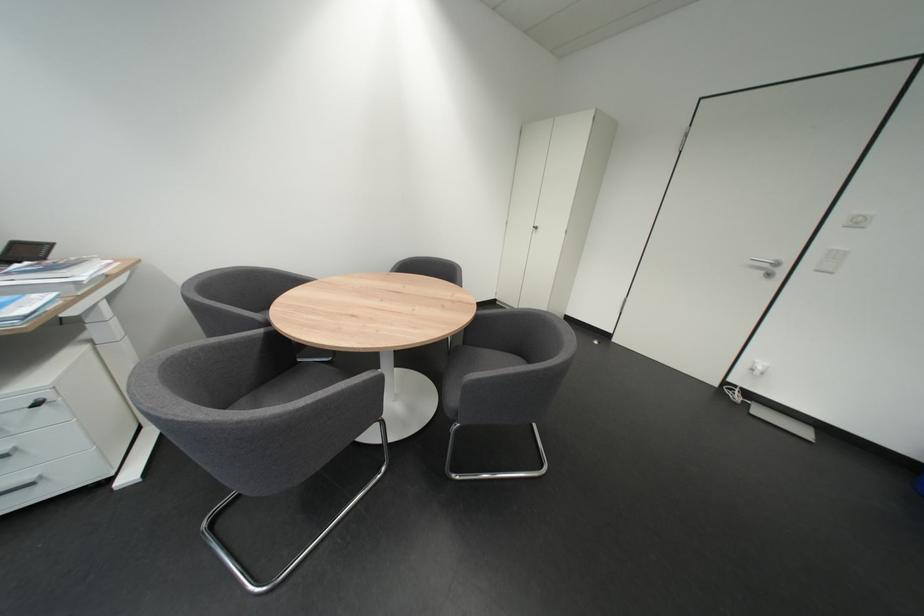
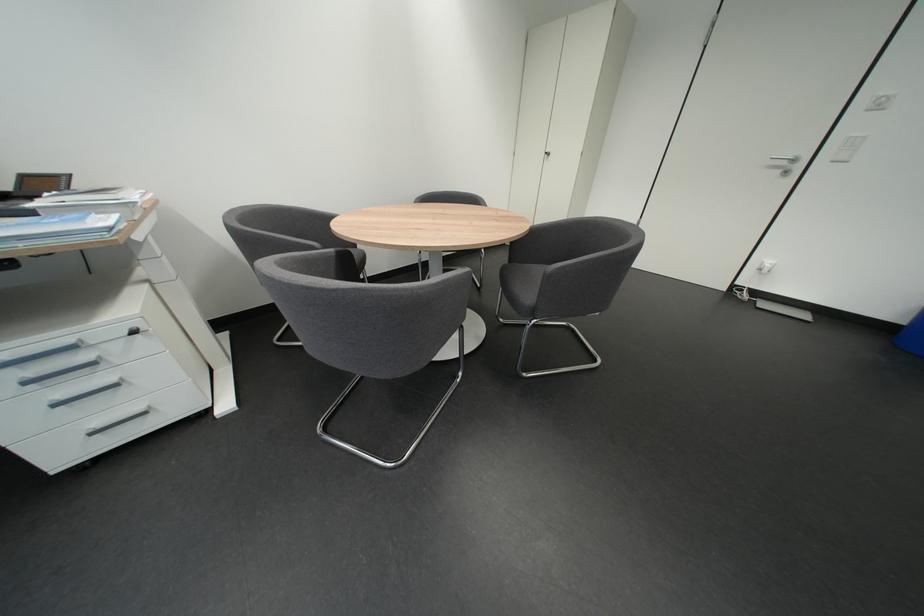
Question: How did the camera likely rotate?

Choices:
 (A) Left
 (B) Right
 (C) Up
 (D) Down

Answer: (D)